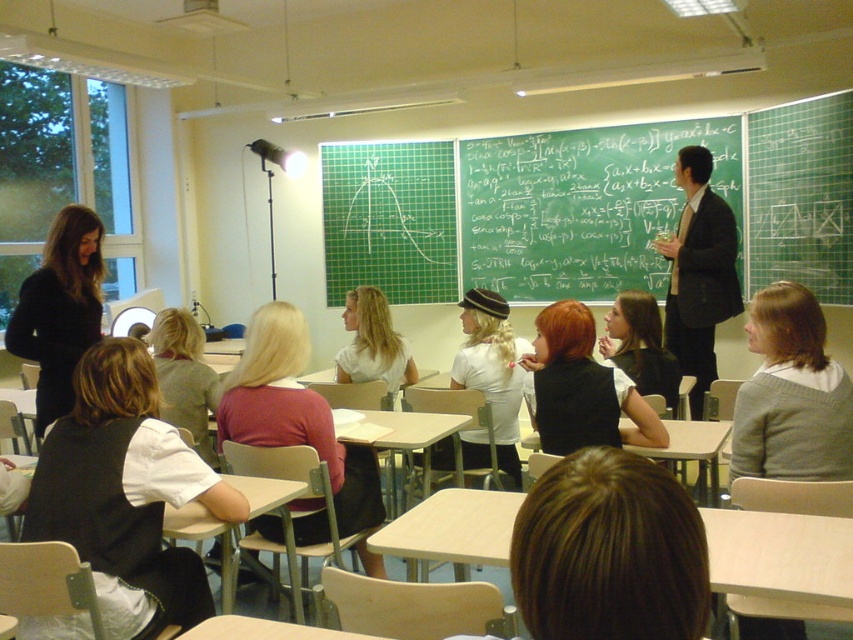
Question: Considering the relative positions of green chalkboard at upper center and black suit at center in the image provided, where is green chalkboard at upper center located with respect to black suit at center?

Choices:
 (A) right
 (B) left

Answer: (B)

Question: Does green chalkboard at upper center appear over black suit at center?

Choices:
 (A) no
 (B) yes

Answer: (B)

Question: Can you confirm if green chalkboard at upper center is positioned to the left of black suit at center?

Choices:
 (A) yes
 (B) no

Answer: (A)

Question: Which point is farther to the camera?

Choices:
 (A) black suit at center
 (B) green chalkboard at upper center

Answer: (B)

Question: Which of the following is the farthest from the observer?

Choices:
 (A) black suit at center
 (B) green chalkboard at upper center

Answer: (B)

Question: Which point is farther to the camera?

Choices:
 (A) green chalkboard at upper center
 (B) black suit at center

Answer: (A)